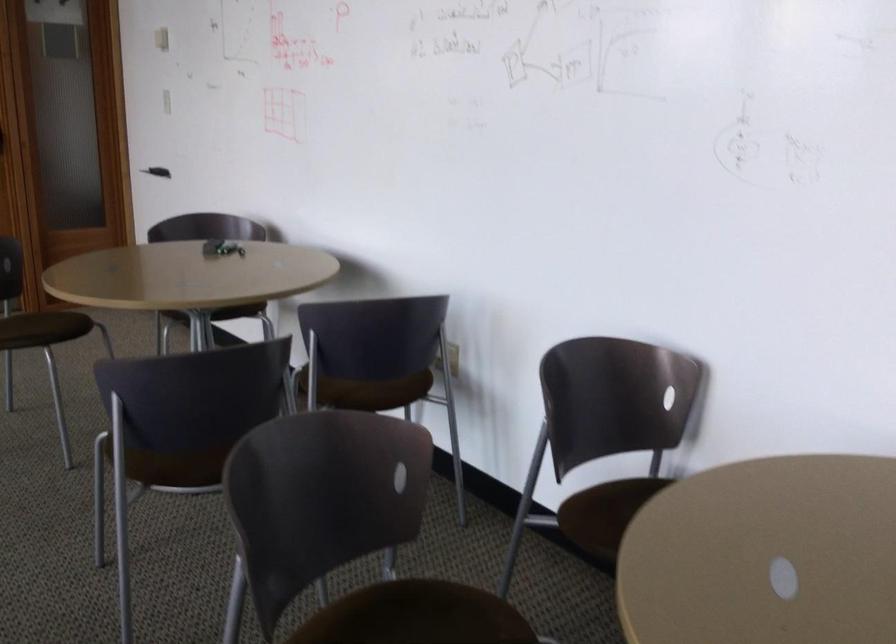
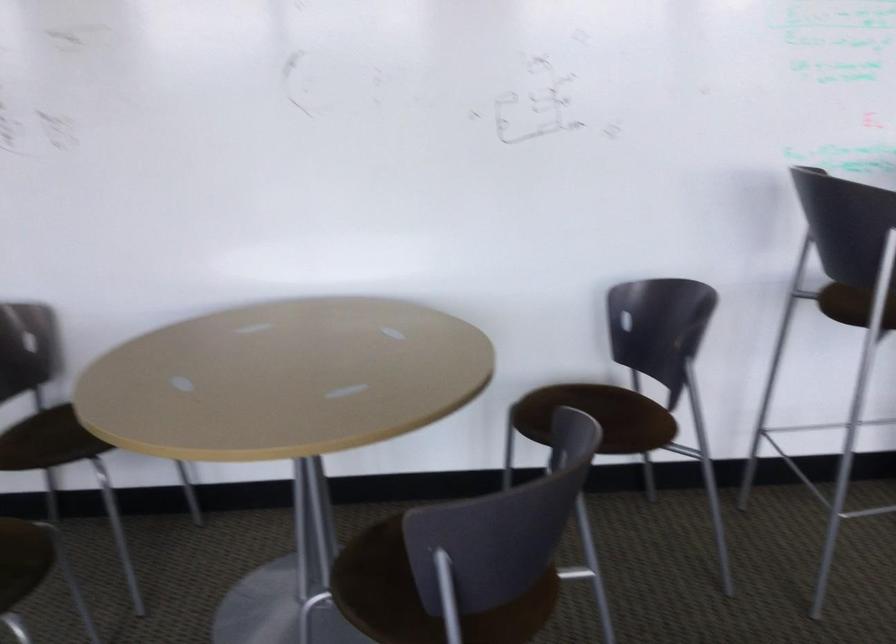
The point at (588,521) is marked in the first image. Where is the corresponding point in the second image?

(26, 442)